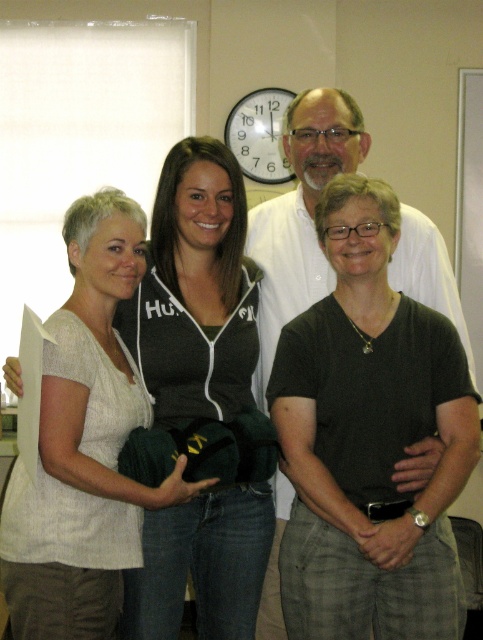
You are an interior designer assessing the layout of this office. You notice the white matte shirt at upper center and the white plastic clock at upper center. Which object takes up more visual space in the scene?

The white matte shirt at upper center has a larger size compared to the white plastic clock at upper center, so it takes up more visual space in the scene.

You are an office worker who needs to locate the clock in the room. You see the light beige fabric shirt at left and the white plastic clock at upper center. Which object is higher up in the image?

The light beige fabric shirt at left is much taller than the white plastic clock at upper center, so the light beige fabric shirt at left is higher up in the image.

You are an office assistant who needs to determine clothing sizes for a group photo. Given the light beige fabric shirt at left and the white matte shirt at upper center, which shirt is narrower?

→ The light beige fabric shirt at left is narrower than the white matte shirt at upper center.